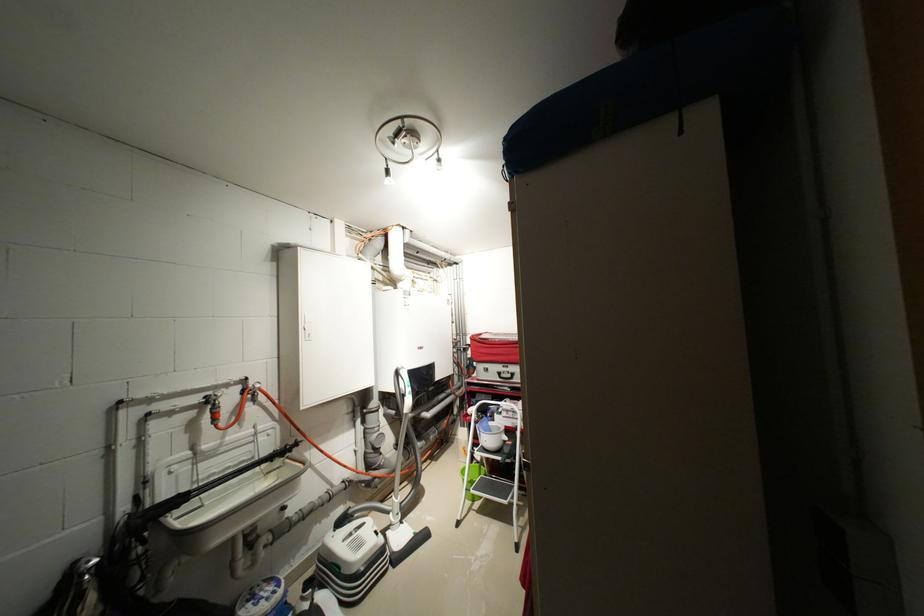
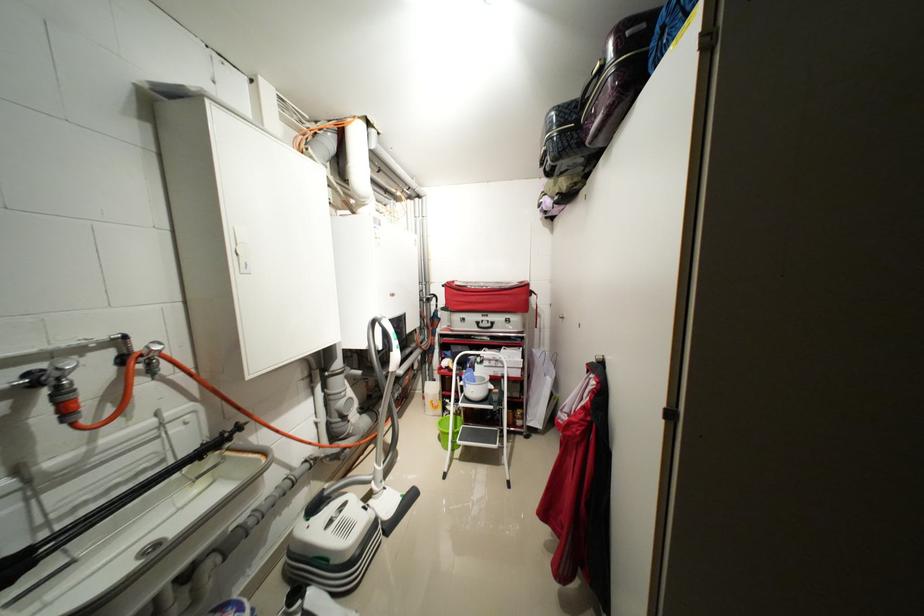
Question: Based on the continuous images, in which direction is the camera rotating? Reply with the corresponding letter.

Choices:
 (A) Left
 (B) Right
 (C) Up
 (D) Down

Answer: (B)